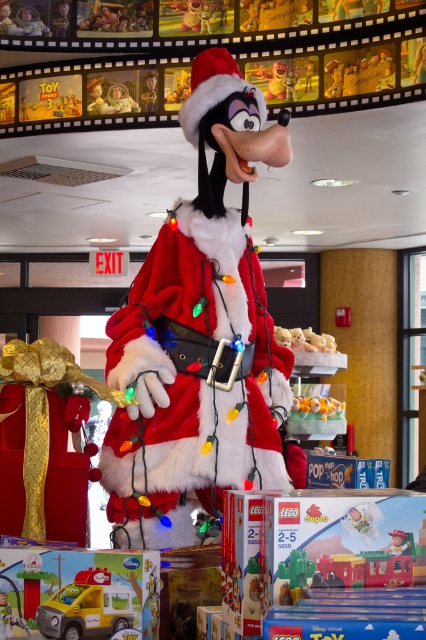
Question: Which object is farther from the camera taking this photo?

Choices:
 (A) plush yellow bear at center
 (B) velvet red gift at center
 (C) fuzzy red santa claus at center

Answer: (A)

Question: Can you confirm if yellow plastic toy truck at lower left is bigger than yellow rubber duck at center?

Choices:
 (A) yes
 (B) no

Answer: (B)

Question: From the image, what is the correct spatial relationship of fuzzy red santa claus at center in relation to yellow plastic toy truck at lower left?

Choices:
 (A) above
 (B) below

Answer: (A)

Question: Which point is closer to the camera?

Choices:
 (A) (307, 406)
 (B) (80, 611)

Answer: (B)

Question: Is yellow plastic toy truck at lower left below yellow rubber duck at center?

Choices:
 (A) yes
 (B) no

Answer: (B)

Question: Among these objects, which one is farthest from the camera?

Choices:
 (A) velvet red gift at center
 (B) yellow plastic toy truck at lower left

Answer: (A)